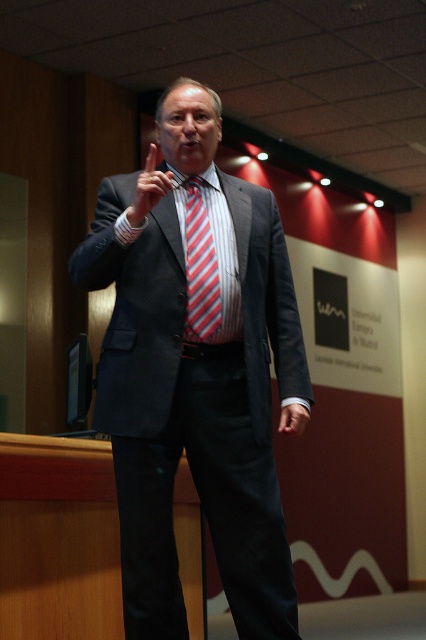
Describe the element at coordinates (199, 268) in the screenshot. The height and width of the screenshot is (640, 426). I see `striped fabric tie at center` at that location.

Is point (216, 269) in front of point (146, 186)?

No, it is not.

What do you see at coordinates (199, 268) in the screenshot?
I see `striped fabric tie at center` at bounding box center [199, 268].

This screenshot has height=640, width=426. Identify the location of striped fabric tie at center. (199, 268).

Is matte black suit at center below striped fabric tie at center?

Indeed, matte black suit at center is positioned under striped fabric tie at center.

Which is behind, point (259, 554) or point (195, 243)?

Point (195, 243)

Does point (209, 362) come in front of point (187, 244)?

That is True.

Locate an element on the screen. matte black suit at center is located at coordinates (195, 372).

Is matte black suit at center bigger than satin smooth hand at center?

Correct, matte black suit at center is larger in size than satin smooth hand at center.

Between point (227, 385) and point (279, 417), which one is positioned behind?

The point (279, 417) is behind.

Image resolution: width=426 pixels, height=640 pixels. I want to click on matte black suit at center, so 195,372.